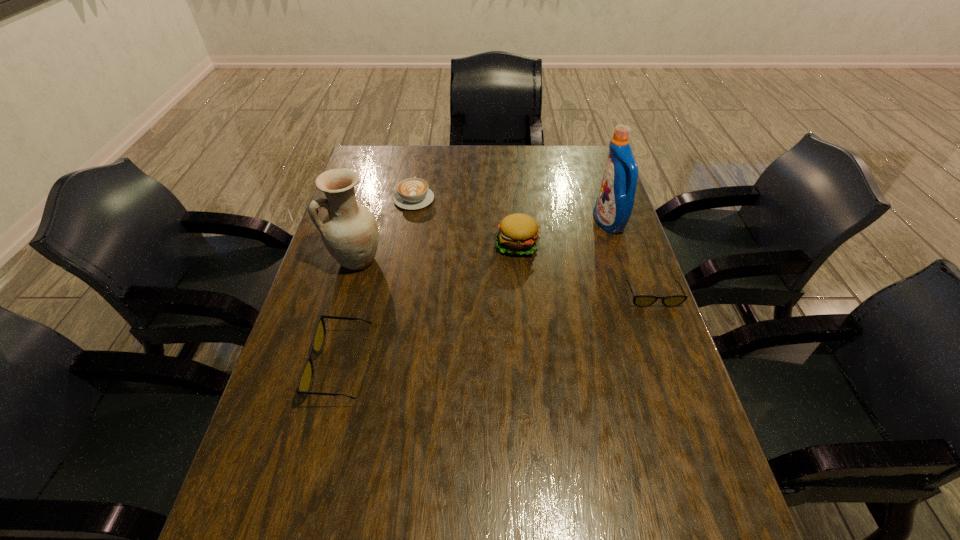
Locate an element on the screen. The width and height of the screenshot is (960, 540). vacant point located between the hamburger and the pottery is located at coordinates (437, 252).

Find the location of `blank region between the pottery and the fourth shortest object`. blank region between the pottery and the fourth shortest object is located at coordinates (437, 252).

Identify the location of unoccupied area between the third tallest object and the right sunglasses. (585, 270).

Find the location of `free space between the detergent and the farther sunglasses`. free space between the detergent and the farther sunglasses is located at coordinates click(x=631, y=259).

This screenshot has height=540, width=960. In order to click on vacant space that's between the detergent and the left sunglasses in this screenshot , I will do `click(475, 294)`.

You are a GUI agent. You are given a task and a screenshot of the screen. Output one action in this format:
    pyautogui.click(x=<x>, y=<y>)
    Task: Click on the free space that is in between the right sunglasses and the pottery
    This screenshot has width=960, height=540.
    Given the screenshot: What is the action you would take?
    pyautogui.click(x=505, y=278)

You are a GUI agent. You are given a task and a screenshot of the screen. Output one action in this format:
    pyautogui.click(x=<x>, y=<y>)
    Task: Click on the vacant point located between the pottery and the left sunglasses
    The height and width of the screenshot is (540, 960).
    Given the screenshot: What is the action you would take?
    pyautogui.click(x=349, y=313)

Image resolution: width=960 pixels, height=540 pixels. I want to click on vacant space that is in between the pottery and the detergent, so click(483, 241).

Select which object appears as the third closest to the second nearest object. Please provide its 2D coordinates. Your answer should be formatted as a tuple, i.e. [(x, y)], where the tuple contains the x and y coordinates of a point satisfying the conditions above.

[(413, 193)]

Choose which object is the third nearest neighbor to the shorter sunglasses. Please provide its 2D coordinates. Your answer should be formatted as a tuple, i.e. [(x, y)], where the tuple contains the x and y coordinates of a point satisfying the conditions above.

[(413, 193)]